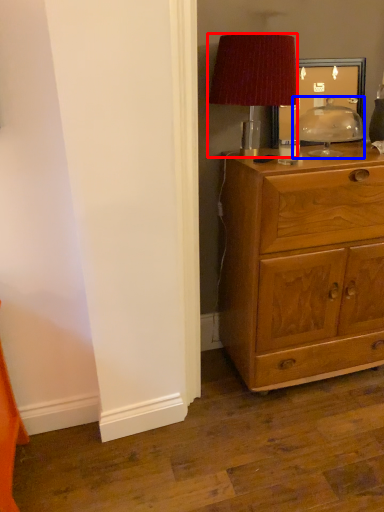
Question: Which of the following is the closest to the observer, lamp (highlighted by a red box) or table lamp (highlighted by a blue box)?

Choices:
 (A) lamp
 (B) table lamp

Answer: (A)